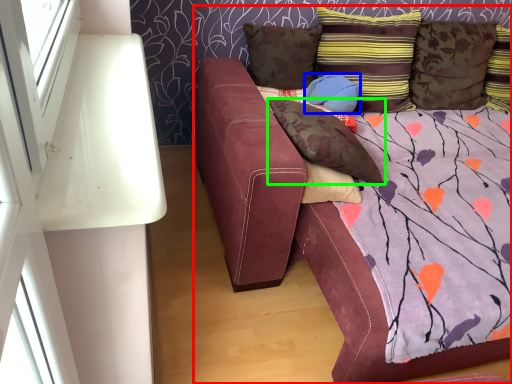
Question: Estimate the real-world distances between objects in this image. Which object is closer to studio couch (highlighted by a red box), pillow (highlighted by a blue box) or pillow (highlighted by a green box)?

Choices:
 (A) pillow
 (B) pillow

Answer: (B)